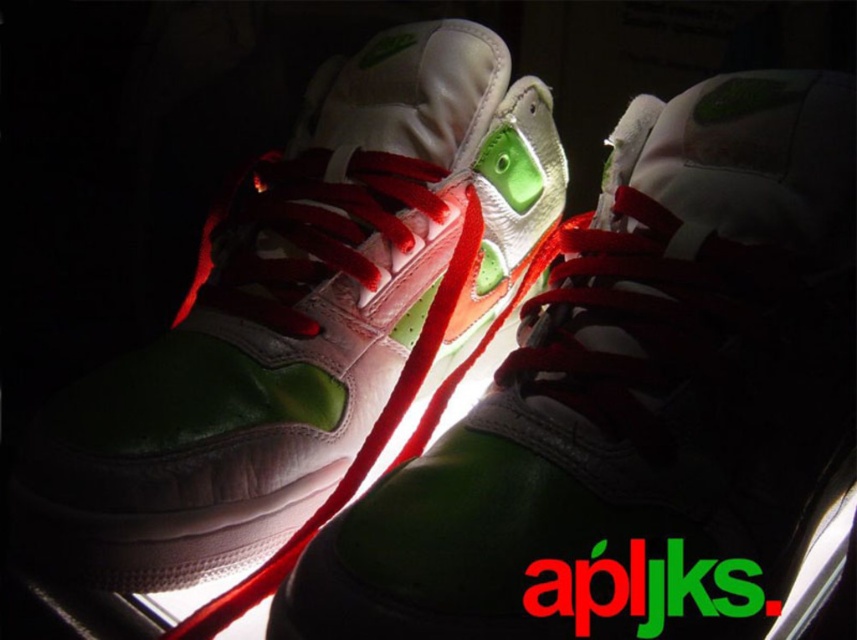
Which is below, green matte running shoe at center or matte white and green sneakers at center?

green matte running shoe at center

Is green matte running shoe at center to the left of matte white and green sneakers at center from the viewer's perspective?

Incorrect, green matte running shoe at center is not on the left side of matte white and green sneakers at center.

Identify the location of green matte running shoe at center. This screenshot has height=640, width=857. (636, 401).